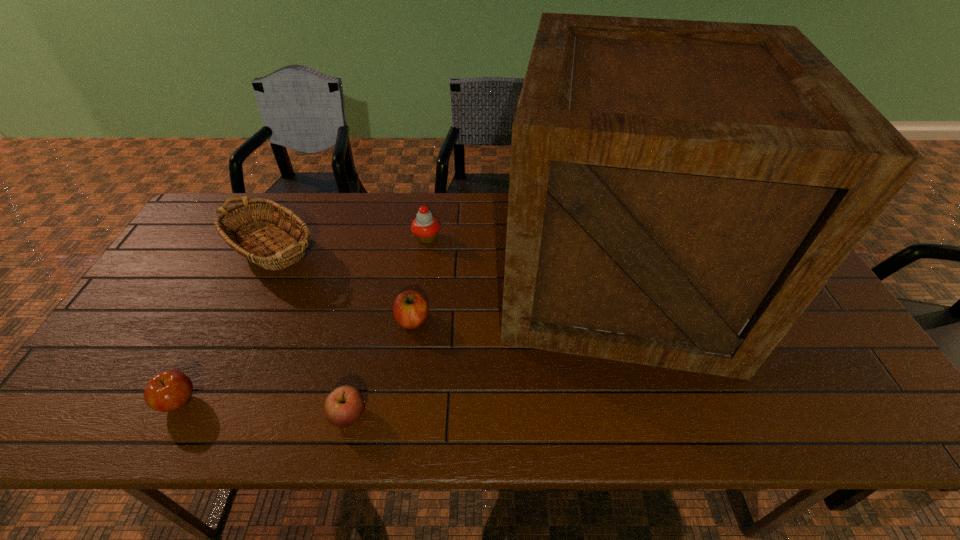
Image resolution: width=960 pixels, height=540 pixels. What are the coordinates of `blank area located on the back of the rightmost apple` in the screenshot? It's located at [x=426, y=220].

You are a GUI agent. You are given a task and a screenshot of the screen. Output one action in this format:
    pyautogui.click(x=<x>, y=<y>)
    Task: Click on the vacant position located on the left of the leftmost apple
    
    Given the screenshot: What is the action you would take?
    pyautogui.click(x=80, y=402)

Identify the location of vacant region located on the back of the second apple from left to right. This screenshot has width=960, height=540. (364, 346).

This screenshot has width=960, height=540. I want to click on box that is at the far edge, so (680, 191).

The width and height of the screenshot is (960, 540). What are the coordinates of `basket present at the far edge` in the screenshot? It's located at (239, 236).

Locate an element on the screen. cupcake that is at the far edge is located at coordinates (425, 227).

This screenshot has height=540, width=960. What are the coordinates of `object positioned at the left edge` in the screenshot? It's located at (239, 236).

Locate an element on the screen. The width and height of the screenshot is (960, 540). object present at the far left corner is located at coordinates (239, 236).

Identify the location of vacant region at the far edge of the desktop. (463, 201).

Identify the location of vacant space at the near edge. The height and width of the screenshot is (540, 960). (276, 415).